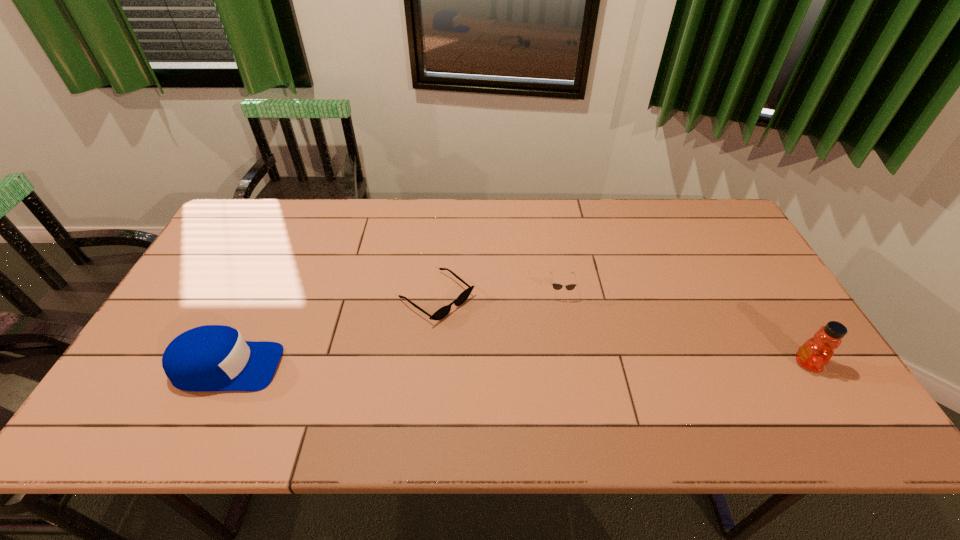
Where is `object that is at the near right corner`? This screenshot has width=960, height=540. object that is at the near right corner is located at coordinates (816, 352).

In the image, there is a desktop. What are the coordinates of `free space at the far edge` in the screenshot? It's located at (545, 204).

The image size is (960, 540). In the image, there is a desktop. Identify the location of free region at the near edge. (346, 374).

Find the location of a particular element. free space at the left edge is located at coordinates (243, 288).

The image size is (960, 540). I want to click on vacant region at the right edge of the desktop, so click(x=749, y=330).

The height and width of the screenshot is (540, 960). In the image, there is a desktop. In order to click on vacant space at the far left corner in this screenshot , I will do `click(244, 218)`.

The width and height of the screenshot is (960, 540). What are the coordinates of `empty space between the shortest object and the second object from right to left` in the screenshot? It's located at pyautogui.click(x=498, y=295).

You are a GUI agent. You are given a task and a screenshot of the screen. Output one action in this format:
    pyautogui.click(x=<x>, y=<y>)
    Task: Click on the free space between the shortest object and the right sunglasses
    This screenshot has width=960, height=540.
    Given the screenshot: What is the action you would take?
    pyautogui.click(x=498, y=295)

This screenshot has width=960, height=540. I want to click on free spot between the leftmost object and the second object from left to right, so coord(332,333).

Where is `empty location between the shortest object and the tallest object`? The width and height of the screenshot is (960, 540). empty location between the shortest object and the tallest object is located at coordinates tap(622, 331).